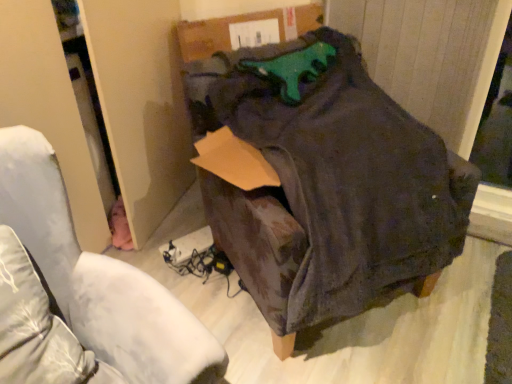
Question: From the image's perspective, is dark fabric bag at center on dark gray suede bean bag chair at center?

Choices:
 (A) no
 (B) yes

Answer: (A)

Question: Considering the relative positions of dark fabric bag at center and dark gray suede bean bag chair at center in the image provided, is dark fabric bag at center to the right of dark gray suede bean bag chair at center from the viewer's perspective?

Choices:
 (A) yes
 (B) no

Answer: (B)

Question: Does dark fabric bag at center touch dark gray suede bean bag chair at center?

Choices:
 (A) no
 (B) yes

Answer: (A)

Question: Is dark fabric bag at center aimed at dark gray suede bean bag chair at center?

Choices:
 (A) no
 (B) yes

Answer: (A)

Question: Does dark fabric bag at center come behind dark gray suede bean bag chair at center?

Choices:
 (A) yes
 (B) no

Answer: (B)

Question: From a real-world perspective, is dark fabric bag at center below dark gray suede bean bag chair at center?

Choices:
 (A) yes
 (B) no

Answer: (A)

Question: From a real-world perspective, is dark gray suede bean bag chair at center positioned under dark fabric bag at center based on gravity?

Choices:
 (A) no
 (B) yes

Answer: (A)

Question: Would you say dark gray suede bean bag chair at center contains dark fabric bag at center?

Choices:
 (A) yes
 (B) no

Answer: (B)

Question: Can you confirm if dark gray suede bean bag chair at center is thinner than dark fabric bag at center?

Choices:
 (A) yes
 (B) no

Answer: (B)

Question: From a real-world perspective, is dark gray suede bean bag chair at center positioned over dark fabric bag at center based on gravity?

Choices:
 (A) no
 (B) yes

Answer: (B)

Question: Is dark fabric bag at center at the back of dark gray suede bean bag chair at center?

Choices:
 (A) no
 (B) yes

Answer: (A)

Question: Is dark gray suede bean bag chair at center completely or partially outside of dark fabric bag at center?

Choices:
 (A) yes
 (B) no

Answer: (A)

Question: Is dark fabric bag at center to the left or to the right of dark gray suede bean bag chair at center in the image?

Choices:
 (A) left
 (B) right

Answer: (A)